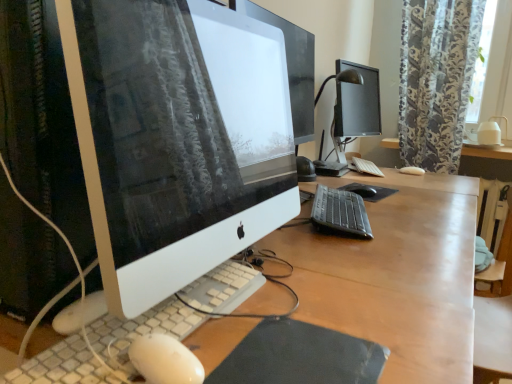
Question: From the image's perspective, is black matte mouse at center beneath floral-patterned fabric at upper right?

Choices:
 (A) yes
 (B) no

Answer: (A)

Question: Does black matte mouse at center appear on the left side of floral-patterned fabric at upper right?

Choices:
 (A) no
 (B) yes

Answer: (B)

Question: Is black matte mouse at center in front of floral-patterned fabric at upper right?

Choices:
 (A) no
 (B) yes

Answer: (B)

Question: Can you confirm if black matte mouse at center is wider than floral-patterned fabric at upper right?

Choices:
 (A) no
 (B) yes

Answer: (A)

Question: Is black matte mouse at center smaller than floral-patterned fabric at upper right?

Choices:
 (A) no
 (B) yes

Answer: (B)

Question: Does black matte mouse at center have a lesser height compared to floral-patterned fabric at upper right?

Choices:
 (A) no
 (B) yes

Answer: (B)

Question: Would you say black glossy monitor at upper right is a long distance from black plastic keyboard at center, the second computer keyboard from the front?

Choices:
 (A) yes
 (B) no

Answer: (B)

Question: Is black glossy monitor at upper right in front of black plastic keyboard at center, marked as the 2th computer keyboard in a top-to-bottom arrangement?

Choices:
 (A) no
 (B) yes

Answer: (A)

Question: Does black glossy monitor at upper right lie behind black plastic keyboard at center, acting as the second computer keyboard starting from the left?

Choices:
 (A) no
 (B) yes

Answer: (B)

Question: Is black glossy monitor at upper right turned away from black plastic keyboard at center, the second computer keyboard from the front?

Choices:
 (A) yes
 (B) no

Answer: (B)

Question: Is black glossy monitor at upper right touching black plastic keyboard at center, acting as the 2th computer keyboard starting from the back?

Choices:
 (A) yes
 (B) no

Answer: (B)

Question: Does black glossy monitor at upper right have a larger size compared to black plastic keyboard at center, marked as the 2th computer keyboard in a top-to-bottom arrangement?

Choices:
 (A) yes
 (B) no

Answer: (A)

Question: Is black glossy monitor at upper right bigger than black matte mousepad at lower center, marked as the second mousepad in a back-to-front arrangement?

Choices:
 (A) yes
 (B) no

Answer: (A)